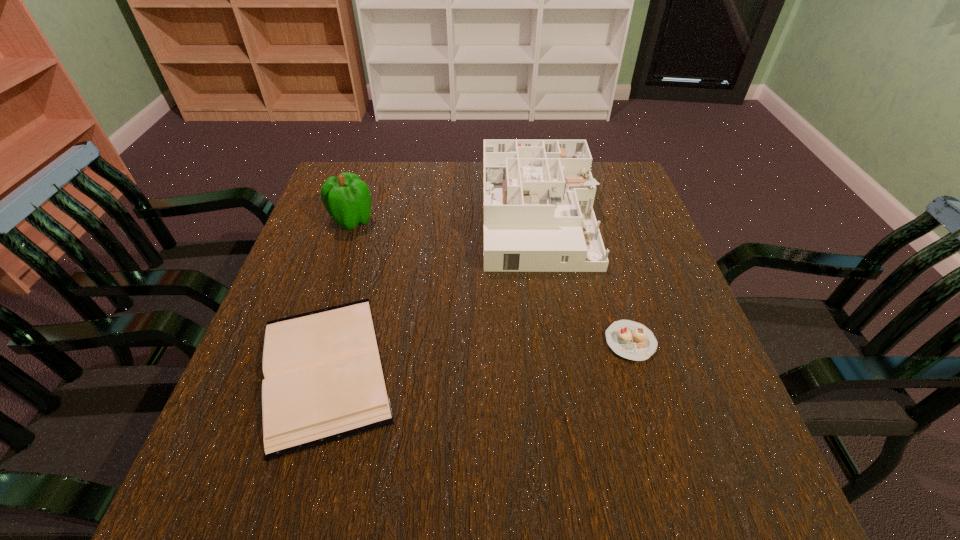
At what (x,y) coordinates should I click in order to perform the action: click on object at the near edge. Please return your answer as a coordinate pair (x, y). The image size is (960, 540). Looking at the image, I should click on (324, 381).

Where is `bell pepper positioned at the left edge`? The width and height of the screenshot is (960, 540). bell pepper positioned at the left edge is located at coordinates (347, 198).

This screenshot has width=960, height=540. I want to click on hardback book at the left edge, so click(324, 381).

The height and width of the screenshot is (540, 960). Identify the location of dollhouse that is at the right edge. (538, 195).

Identify the location of cupcake located in the right edge section of the desktop. (631, 340).

I want to click on object that is at the far left corner, so click(x=347, y=198).

The height and width of the screenshot is (540, 960). Identify the location of object positioned at the near left corner. (324, 381).

I want to click on object present at the far right corner, so click(x=538, y=195).

Locate an element on the screen. This screenshot has width=960, height=540. vacant position at the far edge of the desktop is located at coordinates (468, 178).

This screenshot has height=540, width=960. In the image, there is a desktop. Find the location of `blank space at the near edge`. blank space at the near edge is located at coordinates [x=495, y=465].